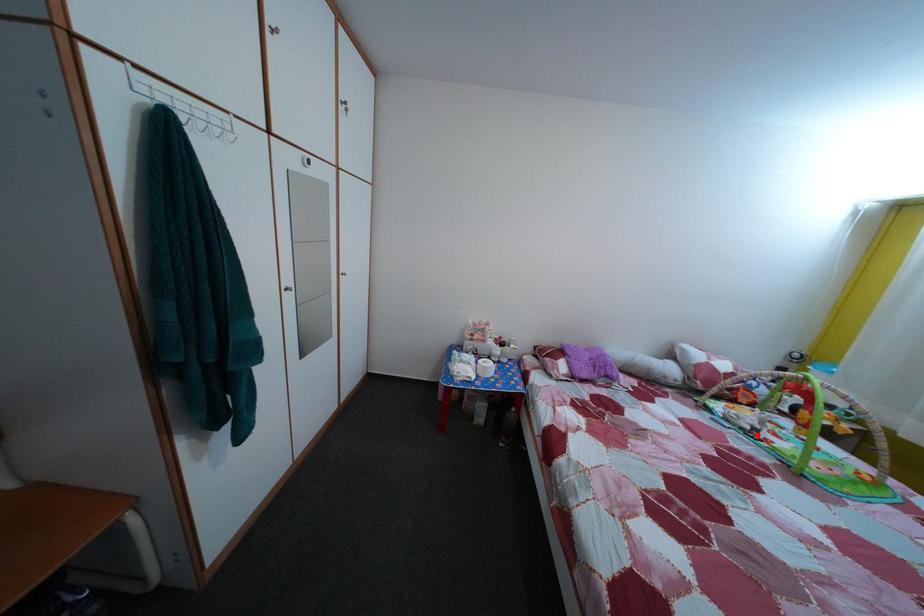
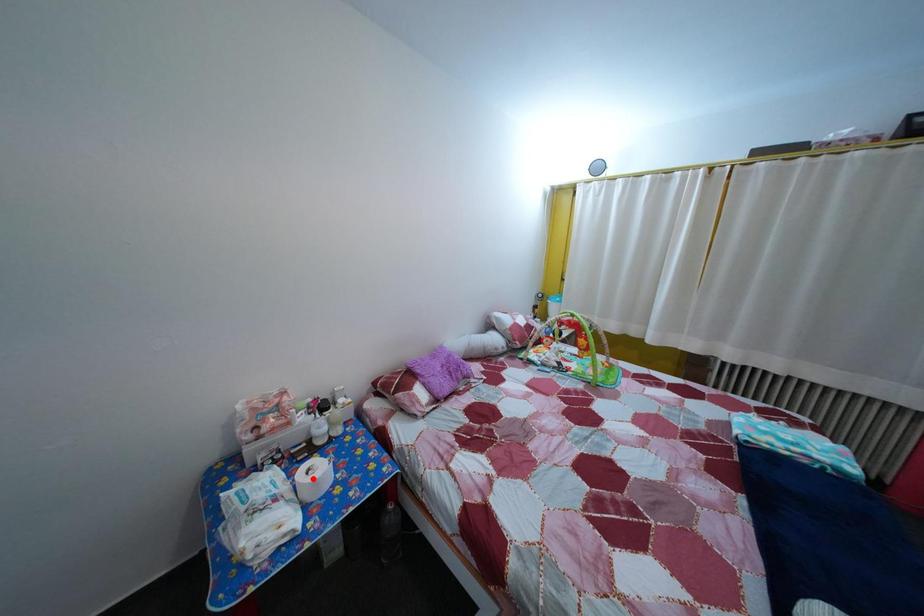
I am providing you with two images of the same scene from different viewpoints. A red point is marked on the first image and another point is marked on the second image. Does the point marked in image1 correspond to the same location as the one in image2?

No